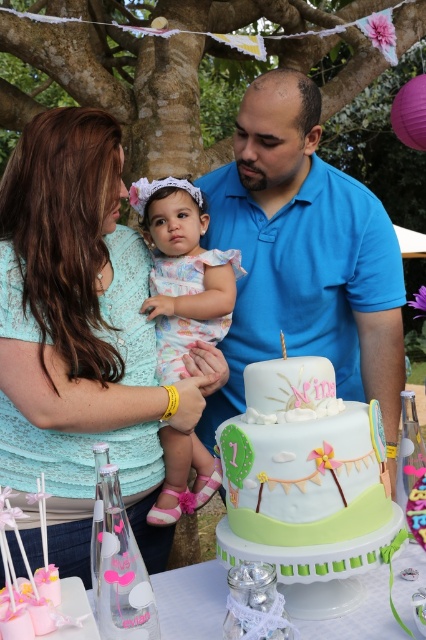
Does matte teal lace dress at upper left lie behind blue smooth shirt at center?

No.

How far apart are matte teal lace dress at upper left and blue smooth shirt at center?

matte teal lace dress at upper left is 40.72 centimeters from blue smooth shirt at center.

This screenshot has width=426, height=640. Find the location of `matte teal lace dress at upper left`. matte teal lace dress at upper left is located at coordinates (80, 336).

This screenshot has width=426, height=640. What are the coordinates of `matte teal lace dress at upper left` in the screenshot? It's located at tap(80, 336).

Is matte teal lace dress at upper left shorter than pastel floral dress at center?

In fact, matte teal lace dress at upper left may be taller than pastel floral dress at center.

Consider the image. Can you confirm if matte teal lace dress at upper left is taller than pastel floral dress at center?

Indeed, matte teal lace dress at upper left has a greater height compared to pastel floral dress at center.

Is point (23, 298) in front of point (190, 291)?

Yes, it is in front of point (190, 291).

Locate an element on the screen. matte teal lace dress at upper left is located at coordinates (80, 336).

Between blue smooth shirt at center and pastel fondant cake at center, which one is positioned lower?

pastel fondant cake at center

Who is shorter, blue smooth shirt at center or pastel fondant cake at center?

pastel fondant cake at center is shorter.

Is point (389, 280) closer to viewer compared to point (360, 444)?

That is False.

The width and height of the screenshot is (426, 640). Find the location of `blue smooth shirt at center`. blue smooth shirt at center is located at coordinates (304, 257).